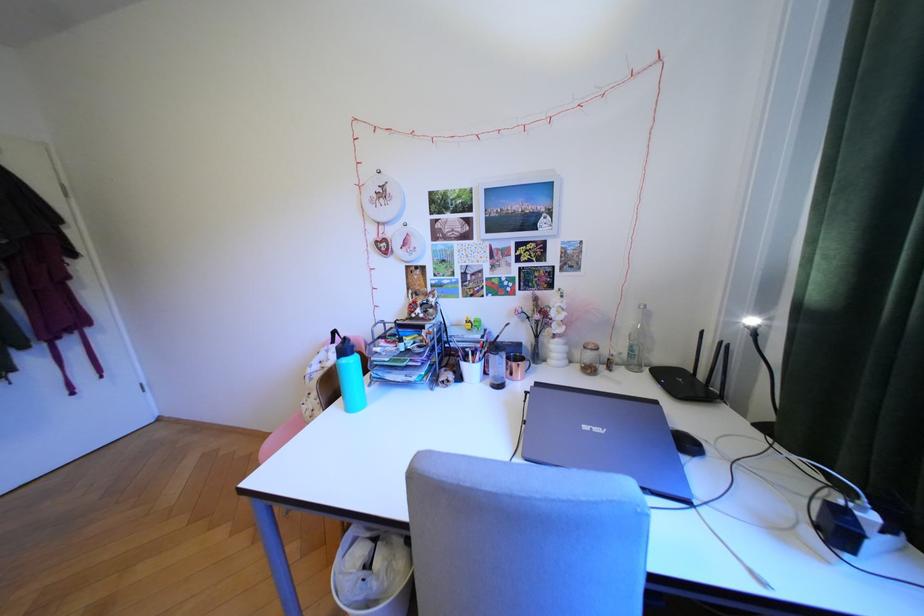
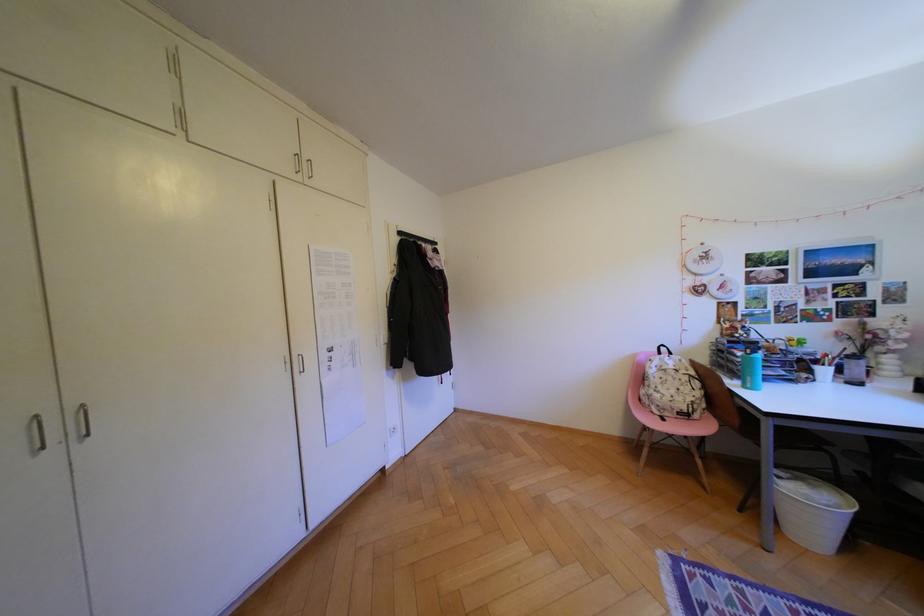
In a continuous first-person perspective shot, in which direction is the camera moving?

The cameraman moved toward left, backward.